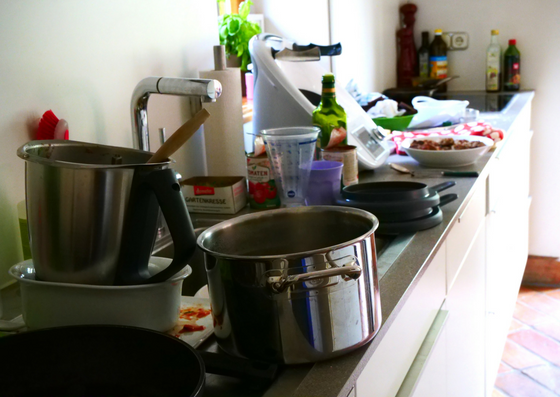
Where is `cup`? This screenshot has height=397, width=560. cup is located at coordinates coord(294,183), coord(320,186), coord(348,168).